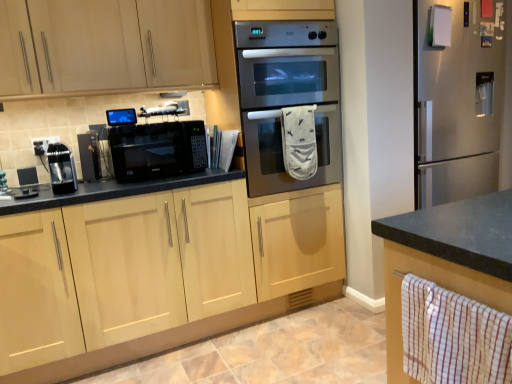
This screenshot has height=384, width=512. In order to click on vacant area to the right of satin black coffee maker at left, placed as the 3th appliance when sorted from right to left in this screenshot , I will do `click(97, 188)`.